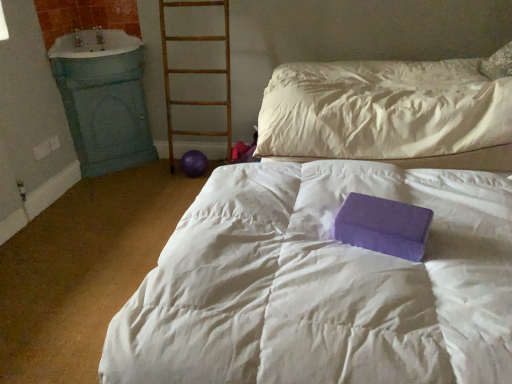
Image resolution: width=512 pixels, height=384 pixels. What do you see at coordinates (196, 73) in the screenshot?
I see `wooden ladder at center` at bounding box center [196, 73].

I want to click on purple matte foam block at center, so click(383, 226).

What do you see at coordinates (339, 242) in the screenshot? The image size is (512, 384). I see `purple foam block at center` at bounding box center [339, 242].

Find the location of a particular element. The width and height of the screenshot is (512, 384). blue painted wood sink at left is located at coordinates (94, 44).

From the image's perspective, is purple matte foam block at center on wooden ladder at center?

No, from the image's perspective, purple matte foam block at center is not above wooden ladder at center.

You are a GUI agent. You are given a task and a screenshot of the screen. Output one action in this format:
    pyautogui.click(x=<x>, y=<y>)
    Task: Click on the paperback book located on the right of wooden ladder at center
    The width and height of the screenshot is (512, 384).
    Given the screenshot: What is the action you would take?
    pyautogui.click(x=383, y=226)

Looking at this image, is purple matte foam block at center positioned in front of wooden ladder at center?

Yes.

Between purple foam block at center and wooden ladder at center, which one is positioned in front?

purple foam block at center.

This screenshot has width=512, height=384. Identify the location of ladder that is above the purple foam block at center (from a real-world perspective). (196, 73).

Is point (487, 223) closer or farther from the camera than point (222, 73)?

Point (487, 223) appears to be closer to the viewer than point (222, 73).

Is purple foam block at center looking in the opposite direction of wooden ladder at center?

No, purple foam block at center is not facing the opposite direction of wooden ladder at center.

Considering the sizes of objects purple foam block at center and blue painted wood sink at left in the image provided, who is smaller, purple foam block at center or blue painted wood sink at left?

Smaller between the two is blue painted wood sink at left.

Which object is closer to the camera taking this photo, purple foam block at center or blue painted wood sink at left?

purple foam block at center.

From the picture: Is blue painted wood sink at left completely or partially inside purple foam block at center?

Definitely not — blue painted wood sink at left is not inside purple foam block at center.

Consider the image. How many degrees apart are the facing directions of purple foam block at center and blue painted wood sink at left?

There is a 87.1-degree angle between the facing directions of purple foam block at center and blue painted wood sink at left.

In the scene shown: Looking at the image, does blue painted wood sink at left seem bigger or smaller compared to wooden ladder at center?

In the image, blue painted wood sink at left appears to be smaller than wooden ladder at center.

From a real-world perspective, which is physically below, blue painted wood sink at left or wooden ladder at center?

From a 3D spatial view, wooden ladder at center is below.

Is blue painted wood sink at left shorter than wooden ladder at center?

Indeed, blue painted wood sink at left has a lesser height compared to wooden ladder at center.

Identify the location of paperback book above the purple foam block at center (from a real-world perspective). (383, 226).

Considering the sizes of objects purple foam block at center and purple matte foam block at center in the image provided, who is bigger, purple foam block at center or purple matte foam block at center?

With larger size is purple foam block at center.

Measure the distance from purple foam block at center to purple matte foam block at center.

They are 6.57 inches apart.

From the image's perspective, is purple foam block at center located above or below purple matte foam block at center?

purple foam block at center is below purple matte foam block at center.

From a real-world perspective, between wooden ladder at center and purple foam block at center, who is vertically lower?

From a 3D spatial view, purple foam block at center is below.

Is point (169, 105) behind point (509, 342)?

Yes, point (169, 105) is behind point (509, 342).

Considering the relative sizes of wooden ladder at center and purple foam block at center in the image provided, is wooden ladder at center wider than purple foam block at center?

No, wooden ladder at center is not wider than purple foam block at center.

Is wooden ladder at center in front of or behind purple foam block at center in the image?

wooden ladder at center is positioned farther from the viewer than purple foam block at center.

Which is more to the right, purple matte foam block at center or blue painted wood sink at left?

purple matte foam block at center.

Between purple matte foam block at center and blue painted wood sink at left, which one has larger width?

blue painted wood sink at left is wider.

Does purple matte foam block at center come in front of blue painted wood sink at left?

Yes, it is in front of blue painted wood sink at left.

Which of these two, purple matte foam block at center or blue painted wood sink at left, stands shorter?

purple matte foam block at center.

Image resolution: width=512 pixels, height=384 pixels. Identify the location of ladder that appears below the purple matte foam block at center (from a real-world perspective). (196, 73).

The image size is (512, 384). What are the coordinates of `bed lying in front of the wooden ladder at center` in the screenshot? It's located at (339, 242).

Which object lies further to the anchor point purple foam block at center, blue painted wood sink at left or wooden ladder at center?

Among the two, blue painted wood sink at left is located further to purple foam block at center.

From the image, which object appears to be farther from blue painted wood sink at left, wooden ladder at center or purple matte foam block at center?

Among the two, purple matte foam block at center is located further to blue painted wood sink at left.

Which object lies further to the anchor point wooden ladder at center, blue painted wood sink at left or purple foam block at center?

Based on the image, purple foam block at center appears to be further to wooden ladder at center.

When comparing their distances from purple foam block at center, does wooden ladder at center or blue painted wood sink at left seem closer?

wooden ladder at center is closer to purple foam block at center.

Considering their positions, is purple foam block at center positioned further to purple matte foam block at center than blue painted wood sink at left?

Based on the image, blue painted wood sink at left appears to be further to purple matte foam block at center.

Based on their spatial positions, is wooden ladder at center or blue painted wood sink at left closer to purple matte foam block at center?

wooden ladder at center is closer to purple matte foam block at center.

Considering their positions, is purple foam block at center positioned closer to blue painted wood sink at left than wooden ladder at center?

wooden ladder at center.

Consider the image. When comparing their distances from blue painted wood sink at left, does purple matte foam block at center or purple foam block at center seem further?

Based on the image, purple matte foam block at center appears to be further to blue painted wood sink at left.

I want to click on sink positioned between purple matte foam block at center and wooden ladder at center from near to far, so click(94, 44).

Locate an element on the screen. sink between purple foam block at center and wooden ladder at center in the front-back direction is located at coordinates (94, 44).

Identify the location of bed between purple matte foam block at center and wooden ladder at center in the front-back direction. This screenshot has width=512, height=384. 339,242.

The width and height of the screenshot is (512, 384). Find the location of `bed between purple matte foam block at center and blue painted wood sink at left in the front-back direction`. bed between purple matte foam block at center and blue painted wood sink at left in the front-back direction is located at coordinates (339, 242).